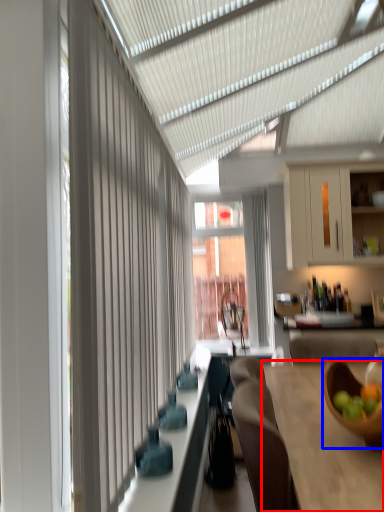
Question: Which point is further to the camera, table (highlighted by a red box) or bowl (highlighted by a blue box)?

Choices:
 (A) table
 (B) bowl

Answer: (B)